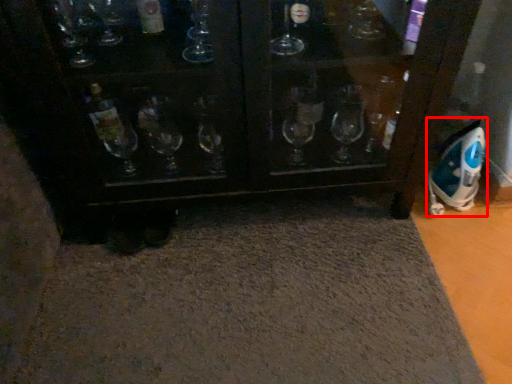
Question: From the image's perspective, where is appliance (annotated by the red box) located in relation to bath mat in the image?

Choices:
 (A) above
 (B) below

Answer: (A)